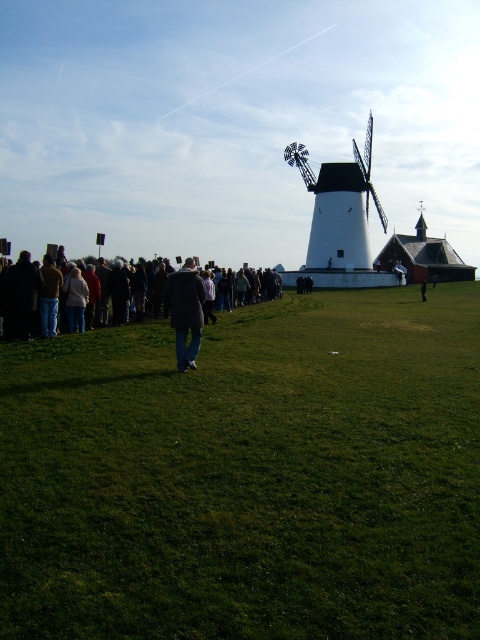
Which is below, green grassy field at lower center or dark gray coat at center?

green grassy field at lower center is below.

Describe the element at coordinates (248, 476) in the screenshot. This screenshot has height=640, width=480. I see `green grassy field at lower center` at that location.

The width and height of the screenshot is (480, 640). What do you see at coordinates (248, 476) in the screenshot? I see `green grassy field at lower center` at bounding box center [248, 476].

Locate an element on the screen. The width and height of the screenshot is (480, 640). green grassy field at lower center is located at coordinates (248, 476).

Which is below, green grassy field at lower center or dark wool coat at center?

green grassy field at lower center

Can you confirm if green grassy field at lower center is positioned to the left of dark wool coat at center?

No, green grassy field at lower center is not to the left of dark wool coat at center.

The image size is (480, 640). In order to click on green grassy field at lower center in this screenshot , I will do `click(248, 476)`.

Identify the location of green grassy field at lower center. This screenshot has height=640, width=480. (248, 476).

Is dark gray coat at center bigger than jeans at center?

Indeed, dark gray coat at center has a larger size compared to jeans at center.

Is dark gray coat at center closer to camera compared to jeans at center?

Yes, dark gray coat at center is in front of jeans at center.

Locate an element on the screen. dark gray coat at center is located at coordinates (32, 296).

Find the location of a particular element. The height and width of the screenshot is (640, 480). dark gray coat at center is located at coordinates (32, 296).